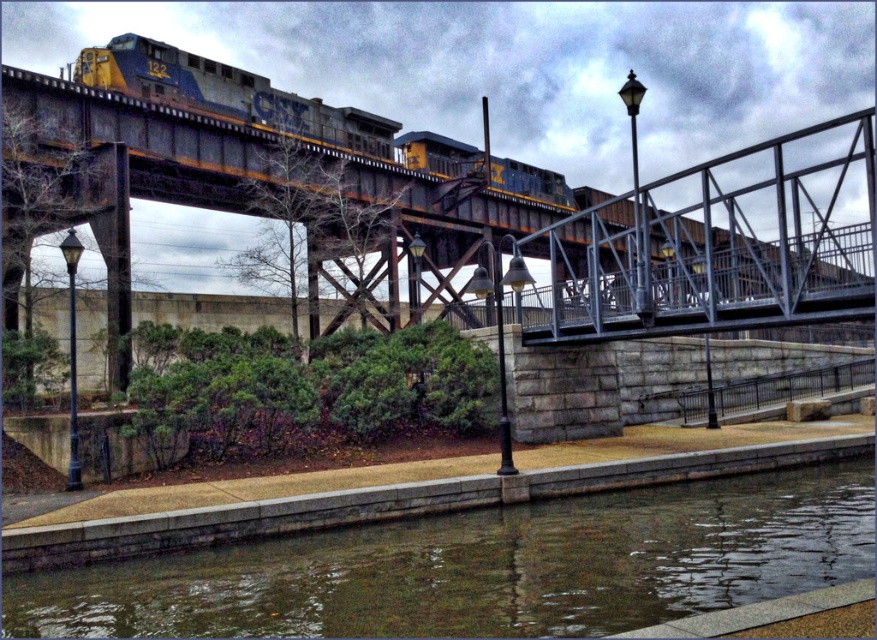
You are a photographer trying to capture the entire scene in one shot. Given that the rusty metal bridge at upper center and the smooth concrete river at lower center are both in view, which object should you focus on to ensure both are clearly visible in your photo?

You should focus on the rusty metal bridge at upper center because it is larger in size than the smooth concrete river at lower center, making it easier to capture both objects clearly in the frame.